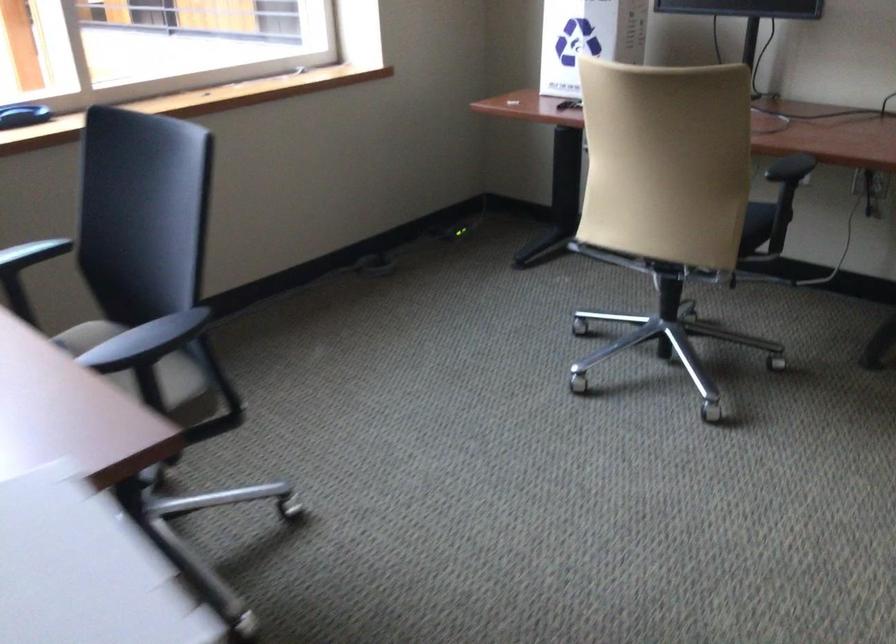
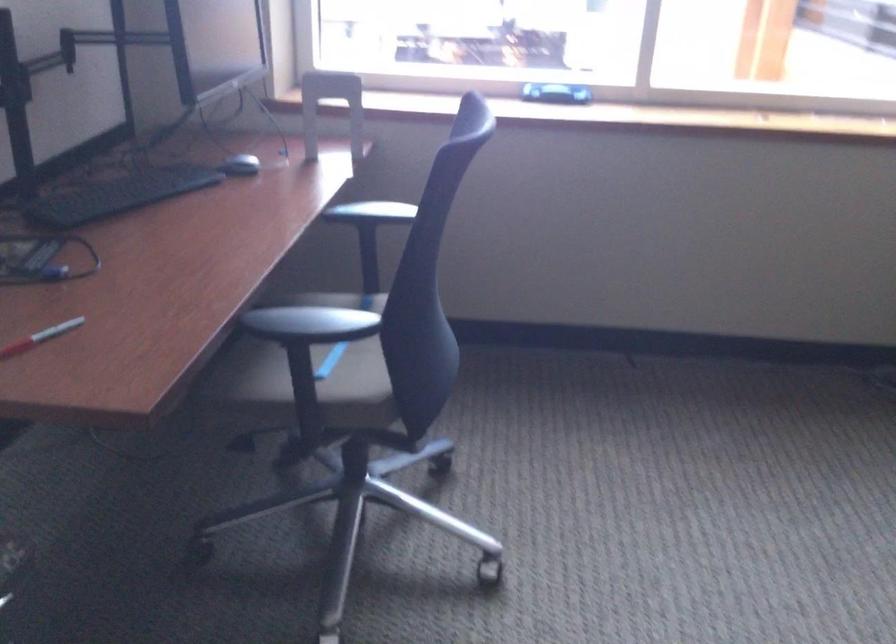
Question: The camera is either moving clockwise (left) or counter-clockwise (right) around the object. The first image is from the beginning of the video and the second image is from the end. Is the camera moving left or right when shooting the video?

Choices:
 (A) Left
 (B) Right

Answer: (B)